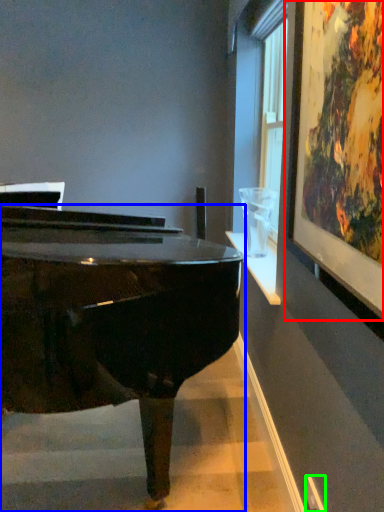
Question: Which object is positioned closest to picture frame (highlighted by a red box)? Select from piano (highlighted by a blue box) and power outlet (highlighted by a green box).

Choices:
 (A) piano
 (B) power outlet

Answer: (A)